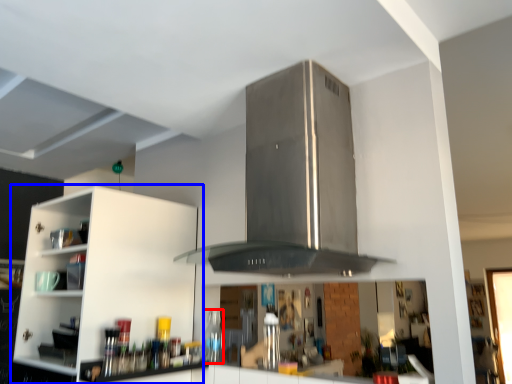
Question: Which object is further to the camera taking this photo, bottle (highlighted by a red box) or cabinetry (highlighted by a blue box)?

Choices:
 (A) bottle
 (B) cabinetry

Answer: (A)